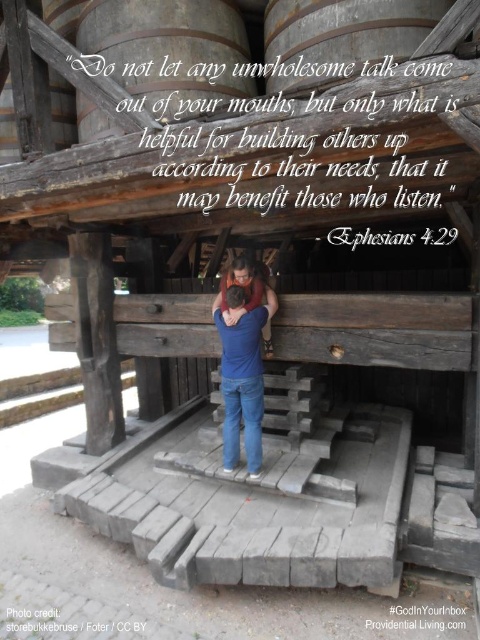
Looking at this image, please describe the exact location of the smooth wooden barrel at upper center in the image using coordinate values.

The smooth wooden barrel at upper center is located at coordinate point (340,36).

You are a tailor observing two pairs of jeans in the scene. Which pair, the blue jeans at center or the blue denim jeans at center, is taller?

The blue jeans at center is taller than the blue denim jeans at center.